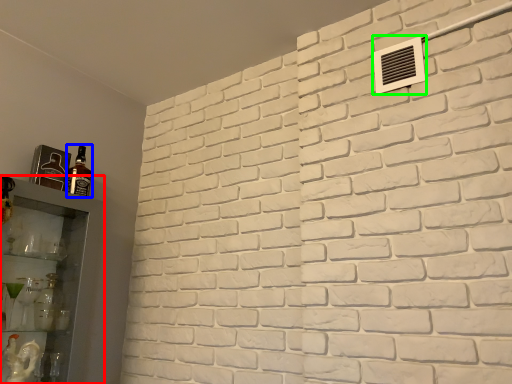
Question: Estimate the real-world distances between objects in this image. Which object is closer to shelf (highlighted by a red box), bottle (highlighted by a blue box) or air conditioning (highlighted by a green box)?

Choices:
 (A) bottle
 (B) air conditioning

Answer: (A)